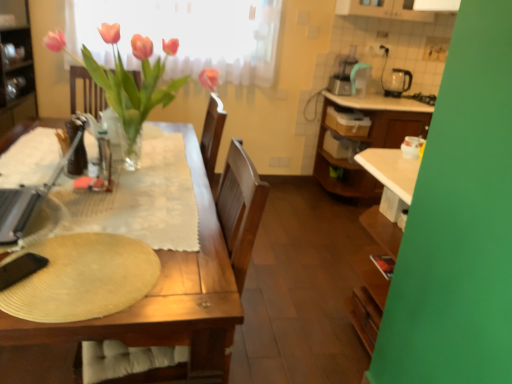
I want to click on black plastic kettle at upper right, the 2th appliance when ordered from front to back, so click(397, 82).

Locate an element on the screen. metallic silver laptop at left, which is counted as the first appliance, starting from the front is located at coordinates (27, 199).

The image size is (512, 384). What do you see at coordinates (104, 162) in the screenshot?
I see `translucent glass bottle at table left` at bounding box center [104, 162].

Where is `black plastic kettle at upper right, which is counted as the first appliance, starting from the right`? This screenshot has width=512, height=384. black plastic kettle at upper right, which is counted as the first appliance, starting from the right is located at coordinates (397, 82).

Looking at this image, considering the sizes of objects metallic silver laptop at left, the 2th appliance when ordered from back to front, and black plastic kettle at upper right, arranged as the 1th appliance when viewed from the back, in the image provided, who is thinner, metallic silver laptop at left, the 2th appliance when ordered from back to front, or black plastic kettle at upper right, arranged as the 1th appliance when viewed from the back,?

With smaller width is black plastic kettle at upper right, arranged as the 1th appliance when viewed from the back.

Between metallic silver laptop at left, the first appliance from the bottom, and black plastic kettle at upper right, which is counted as the first appliance, starting from the right, which one is positioned in front?

metallic silver laptop at left, the first appliance from the bottom, is more forward.

Is black plastic kettle at upper right, the 2th appliance when ordered from front to back, located within metallic silver laptop at left, which is counted as the first appliance, starting from the front?

No, black plastic kettle at upper right, the 2th appliance when ordered from front to back, is not surrounded by metallic silver laptop at left, which is counted as the first appliance, starting from the front.

What's the angular difference between metallic silver laptop at left, which is counted as the 1th appliance, starting from the left, and black plastic kettle at upper right, the 2th appliance when ordered from front to back,'s facing directions?

There is a 85.5-degree angle between the facing directions of metallic silver laptop at left, which is counted as the 1th appliance, starting from the left, and black plastic kettle at upper right, the 2th appliance when ordered from front to back.

Considering the relative sizes of beige textured paper plate at lower left and black plastic kettle at upper right, which is the 2th appliance in bottom-to-top order, in the image provided, is beige textured paper plate at lower left thinner than black plastic kettle at upper right, which is the 2th appliance in bottom-to-top order,?

Incorrect, the width of beige textured paper plate at lower left is not less than that of black plastic kettle at upper right, which is the 2th appliance in bottom-to-top order.

Is black plastic kettle at upper right, arranged as the 1th appliance when viewed from the back, at the back of beige textured paper plate at lower left?

No, beige textured paper plate at lower left is not facing the opposite direction of black plastic kettle at upper right, arranged as the 1th appliance when viewed from the back.

Which is in front, beige textured paper plate at lower left or black plastic kettle at upper right, which is the 2th appliance in bottom-to-top order?

Positioned in front is beige textured paper plate at lower left.

From the image's perspective, which appliance is the 2nd one above the beige textured paper plate at lower left? Please provide its 2D coordinates.

[(397, 82)]

From the image's perspective, count 2nd appliances upward from the beige textured paper plate at lower left and point to it. Please provide its 2D coordinates.

[(397, 82)]

Which object is positioned more to the left, black plastic kettle at upper right, which is counted as the first appliance, starting from the right, or beige textured paper plate at lower left?

From the viewer's perspective, beige textured paper plate at lower left appears more on the left side.

Between black plastic kettle at upper right, which is the 2th appliance in bottom-to-top order, and beige textured paper plate at lower left, which one has less height?

beige textured paper plate at lower left.

Is beige textured paper plate at lower left a part of black plastic kettle at upper right, the 2th appliance when ordered from front to back?

No, black plastic kettle at upper right, the 2th appliance when ordered from front to back, does not contain beige textured paper plate at lower left.

Is point (387, 79) positioned behind point (84, 54)?

Yes.

You are a GUI agent. You are given a task and a screenshot of the screen. Output one action in this format:
    pyautogui.click(x=<x>, y=<y>)
    Task: Click on the houseplant above the black plastic kettle at upper right, which is counted as the first appliance, starting from the right (from a real-world perspective)
    Image resolution: width=512 pixels, height=384 pixels.
    Given the screenshot: What is the action you would take?
    pyautogui.click(x=127, y=79)

Which of these two, black plastic kettle at upper right, the second appliance positioned from the left, or translucent glass vase at center, is wider?

Wider between the two is translucent glass vase at center.

Would you say translucent glass bottle at table left is to the left or to the right of black plastic kettle at upper right, which is the 2th appliance in bottom-to-top order, in the picture?

Based on their positions, translucent glass bottle at table left is located to the left of black plastic kettle at upper right, which is the 2th appliance in bottom-to-top order.

Is translucent glass bottle at table left with black plastic kettle at upper right, which is counted as the first appliance, starting from the right?

translucent glass bottle at table left is not next to black plastic kettle at upper right, which is counted as the first appliance, starting from the right, and they're not touching.

Based on the photo, which point is more distant from viewer, (x=102, y=181) or (x=408, y=73)?

The point (x=408, y=73) is behind.

From the image's perspective, is translucent glass vase at center over beige textured paper plate at lower left?

Indeed, from the image's perspective, translucent glass vase at center is shown above beige textured paper plate at lower left.

Considering the relative sizes of translucent glass vase at center and beige textured paper plate at lower left in the image provided, is translucent glass vase at center shorter than beige textured paper plate at lower left?

Incorrect, the height of translucent glass vase at center does not fall short of that of beige textured paper plate at lower left.

Which is behind, point (157, 60) or point (41, 296)?

Positioned behind is point (157, 60).

Is the surface of translucent glass vase at center in direct contact with beige textured paper plate at lower left?

There is a gap between translucent glass vase at center and beige textured paper plate at lower left.

Is translucent glass bottle at table left situated inside beige textured paper plate at lower left or outside?

translucent glass bottle at table left lies outside beige textured paper plate at lower left.

Measure the distance between translucent glass bottle at table left and beige textured paper plate at lower left.

translucent glass bottle at table left is 56.30 centimeters from beige textured paper plate at lower left.

Considering the relative sizes of translucent glass bottle at table left and beige textured paper plate at lower left in the image provided, is translucent glass bottle at table left taller than beige textured paper plate at lower left?

Correct, translucent glass bottle at table left is much taller as beige textured paper plate at lower left.

From the image's perspective, is translucent glass bottle at table left above or below beige textured paper plate at lower left?

translucent glass bottle at table left is above beige textured paper plate at lower left.

Where is `appliance above the metallic silver laptop at left, which is counted as the first appliance, starting from the front (from the image's perspective)`? Image resolution: width=512 pixels, height=384 pixels. appliance above the metallic silver laptop at left, which is counted as the first appliance, starting from the front (from the image's perspective) is located at coordinates (397, 82).

The image size is (512, 384). I want to click on appliance on the right of beige textured paper plate at lower left, so click(397, 82).

Considering their positions, is translucent glass vase at center positioned closer to metallic silver laptop at left, the 2th appliance when ordered from back to front, than translucent glass bottle at table left?

Among the two, translucent glass bottle at table left is located nearer to metallic silver laptop at left, the 2th appliance when ordered from back to front.

When comparing their distances from black plastic kettle at upper right, the second appliance positioned from the left, does translucent glass bottle at table left or beige textured paper plate at lower left seem closer?

Based on the image, translucent glass bottle at table left appears to be nearer to black plastic kettle at upper right, the second appliance positioned from the left.

Considering their positions, is beige textured paper plate at lower left positioned closer to black plastic kettle at upper right, the second appliance positioned from the left, than metallic silver laptop at left, which is counted as the second appliance, starting from the right?

Based on the image, metallic silver laptop at left, which is counted as the second appliance, starting from the right, appears to be nearer to black plastic kettle at upper right, the second appliance positioned from the left.

Estimate the real-world distances between objects in this image. Which object is further from beige textured paper plate at lower left, translucent glass bottle at table left or translucent glass vase at center?

translucent glass vase at center is positioned further to the anchor beige textured paper plate at lower left.

In the scene shown: Considering their positions, is beige textured paper plate at lower left positioned further to translucent glass vase at center than translucent glass bottle at table left?

beige textured paper plate at lower left lies further to translucent glass vase at center than the other object.

Looking at the image, which one is located closer to translucent glass vase at center, metallic silver laptop at left, which is counted as the first appliance, starting from the front, or translucent glass bottle at table left?

Among the two, translucent glass bottle at table left is located nearer to translucent glass vase at center.

When comparing their distances from translucent glass vase at center, does translucent glass bottle at table left or metallic silver laptop at left, which is counted as the second appliance, starting from the right, seem closer?

The object closer to translucent glass vase at center is translucent glass bottle at table left.

Considering their positions, is black plastic kettle at upper right, the 2th appliance when ordered from front to back, positioned further to translucent glass bottle at table left than beige textured paper plate at lower left?

Based on the image, black plastic kettle at upper right, the 2th appliance when ordered from front to back, appears to be further to translucent glass bottle at table left.

I want to click on bottle between translucent glass vase at center and black plastic kettle at upper right, which is counted as the first appliance, starting from the right, in the front-back direction, so click(x=104, y=162).

The width and height of the screenshot is (512, 384). I want to click on houseplant between metallic silver laptop at left, which is counted as the 1th appliance, starting from the left, and black plastic kettle at upper right, which is counted as the first appliance, starting from the right, in the front-back direction, so click(x=127, y=79).

The width and height of the screenshot is (512, 384). What are the coordinates of `bottle positioned between beige textured paper plate at lower left and black plastic kettle at upper right, the 2th appliance when ordered from front to back, from near to far` in the screenshot? It's located at (104, 162).

I want to click on bottle located between metallic silver laptop at left, marked as the second appliance in a top-to-bottom arrangement, and black plastic kettle at upper right, which is the 2th appliance in bottom-to-top order, in the depth direction, so click(x=104, y=162).